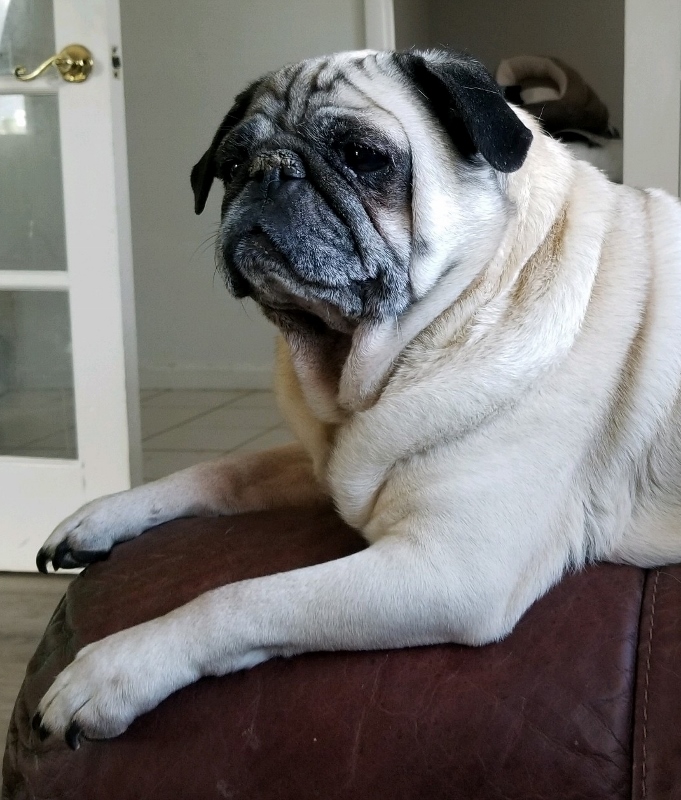
Find the location of a particular element. The width and height of the screenshot is (681, 800). door is located at coordinates (123, 430).